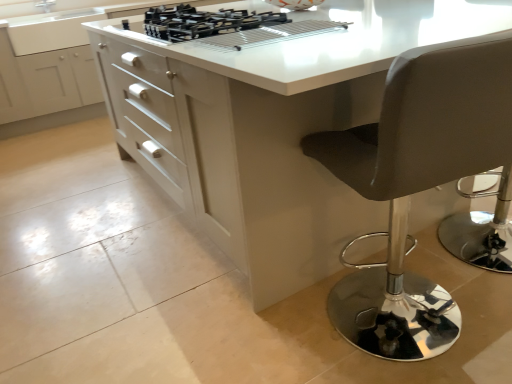
Question: Considering the relative positions of leatherette stool at right and white glossy cabinet at center in the image provided, is leatherette stool at right to the left of white glossy cabinet at center from the viewer's perspective?

Choices:
 (A) no
 (B) yes

Answer: (A)

Question: Does leatherette stool at right have a lesser height compared to white glossy cabinet at center?

Choices:
 (A) no
 (B) yes

Answer: (B)

Question: Is leatherette stool at right far away from white glossy cabinet at center?

Choices:
 (A) no
 (B) yes

Answer: (B)

Question: Is leatherette stool at right not within white glossy cabinet at center?

Choices:
 (A) no
 (B) yes

Answer: (B)

Question: Is white glossy cabinet at center a part of leatherette stool at right?

Choices:
 (A) yes
 (B) no

Answer: (B)

Question: Considering the relative sizes of leatherette stool at right and white glossy cabinet at center in the image provided, is leatherette stool at right bigger than white glossy cabinet at center?

Choices:
 (A) no
 (B) yes

Answer: (A)

Question: Does white glossy table at center appear on the left side of white glossy cabinet at center?

Choices:
 (A) yes
 (B) no

Answer: (B)

Question: From a real-world perspective, is white glossy table at center physically below white glossy cabinet at center?

Choices:
 (A) yes
 (B) no

Answer: (A)

Question: Does white glossy table at center have a lesser width compared to white glossy cabinet at center?

Choices:
 (A) no
 (B) yes

Answer: (A)

Question: Considering the relative sizes of white glossy table at center and white glossy cabinet at center in the image provided, is white glossy table at center taller than white glossy cabinet at center?

Choices:
 (A) no
 (B) yes

Answer: (A)

Question: Is white glossy table at center closer to the viewer compared to white glossy cabinet at center?

Choices:
 (A) no
 (B) yes

Answer: (B)

Question: Considering the relative sizes of white glossy table at center and white glossy cabinet at center in the image provided, is white glossy table at center bigger than white glossy cabinet at center?

Choices:
 (A) yes
 (B) no

Answer: (A)

Question: Is white glossy cabinet at center in contact with black matte gas stove at upper center?

Choices:
 (A) no
 (B) yes

Answer: (A)